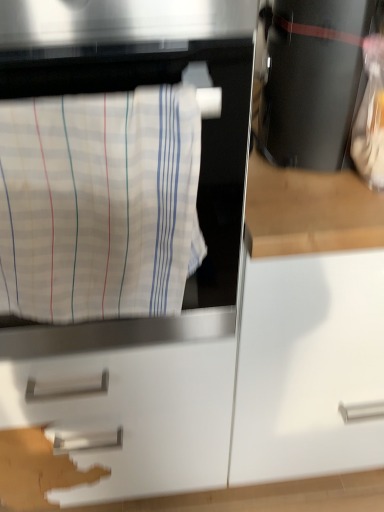
Question: From the image's perspective, would you say black glossy coffee maker at upper right is positioned over white striped fabric at left?

Choices:
 (A) no
 (B) yes

Answer: (B)

Question: From the image's perspective, is black glossy coffee maker at upper right below white striped fabric at left?

Choices:
 (A) yes
 (B) no

Answer: (B)

Question: Does black glossy coffee maker at upper right have a lesser width compared to white striped fabric at left?

Choices:
 (A) yes
 (B) no

Answer: (B)

Question: Is black glossy coffee maker at upper right next to white striped fabric at left and touching it?

Choices:
 (A) yes
 (B) no

Answer: (B)

Question: Does black glossy coffee maker at upper right appear on the left side of white striped fabric at left?

Choices:
 (A) no
 (B) yes

Answer: (A)

Question: Does black glossy coffee maker at upper right have a smaller size compared to white striped fabric at left?

Choices:
 (A) yes
 (B) no

Answer: (B)

Question: From the image's perspective, is white striped fabric at left beneath black glossy coffee maker at upper right?

Choices:
 (A) yes
 (B) no

Answer: (A)

Question: Does white striped fabric at left have a greater width compared to black glossy coffee maker at upper right?

Choices:
 (A) yes
 (B) no

Answer: (B)

Question: Does white striped fabric at left appear on the left side of black glossy coffee maker at upper right?

Choices:
 (A) no
 (B) yes

Answer: (B)

Question: Can you confirm if white striped fabric at left is taller than black glossy coffee maker at upper right?

Choices:
 (A) no
 (B) yes

Answer: (B)

Question: From the image's perspective, is white striped fabric at left above black glossy coffee maker at upper right?

Choices:
 (A) no
 (B) yes

Answer: (A)

Question: Is white striped fabric at left facing away from black glossy coffee maker at upper right?

Choices:
 (A) yes
 (B) no

Answer: (B)

Question: Is black glossy coffee maker at upper right completely or partially inside white matte drawer at center?

Choices:
 (A) no
 (B) yes

Answer: (A)